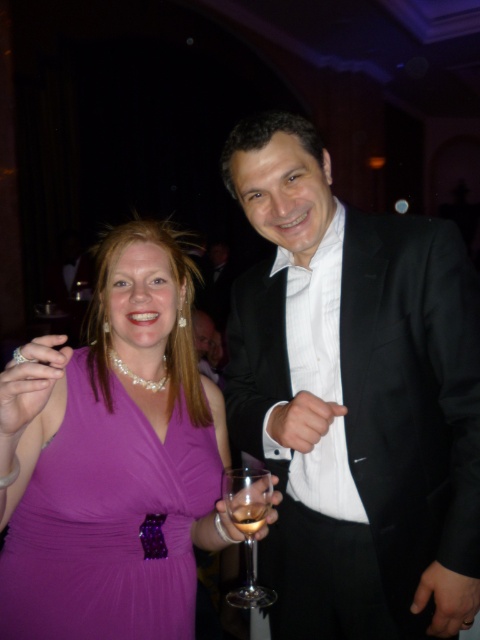
You are a GUI agent. You are given a task and a screenshot of the screen. Output one action in this format:
    pyautogui.click(x=<x>, y=<y>)
    Task: Click on the black satin suit at right
    
    Given the screenshot: What is the action you would take?
    pyautogui.click(x=358, y=400)

Does black satin suit at right have a greater height compared to purple satin dress at center?

Yes, black satin suit at right is taller than purple satin dress at center.

The height and width of the screenshot is (640, 480). I want to click on black satin suit at right, so click(358, 400).

Which of these two, purple satin dress at center or clear glass wine glass at center, stands shorter?

With less height is clear glass wine glass at center.

Is purple satin dress at center in front of clear glass wine glass at center?

Yes, it is.

Locate an element on the screen. The image size is (480, 640). purple satin dress at center is located at coordinates (112, 458).

Can you confirm if black satin suit at right is positioned above clear glass wine glass at center?

Correct, black satin suit at right is located above clear glass wine glass at center.

Looking at this image, is black satin suit at right closer to camera compared to clear glass wine glass at center?

No, black satin suit at right is further to the viewer.

Which is behind, point (440, 340) or point (243, 472)?

Point (440, 340)

This screenshot has width=480, height=640. Identify the location of black satin suit at right. (358, 400).